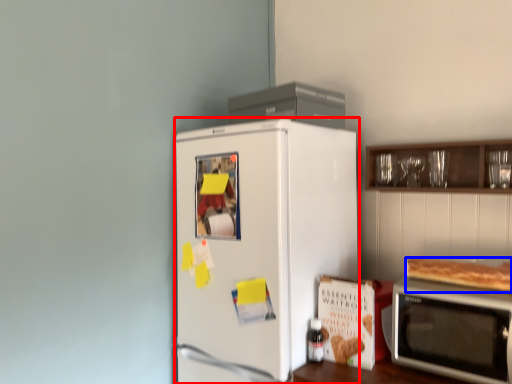
Question: Which object appears closest to the camera in this image, refrigerator (highlighted by a red box) or food (highlighted by a blue box)?

Choices:
 (A) refrigerator
 (B) food

Answer: (B)